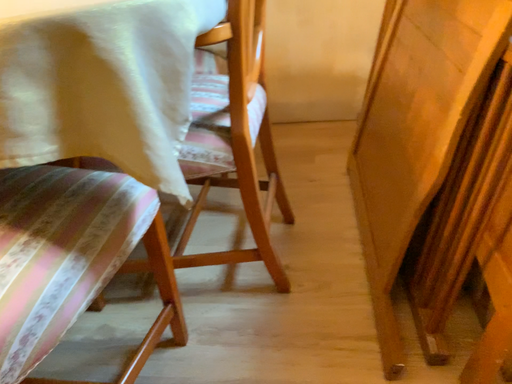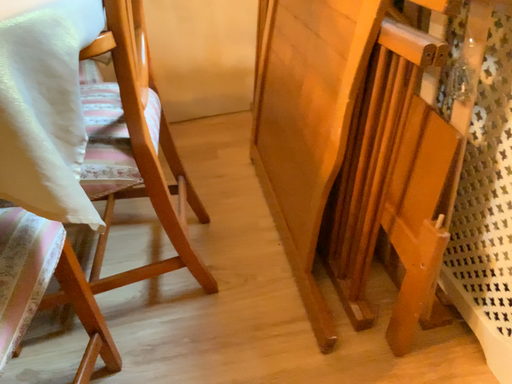
Question: How did the camera likely rotate when shooting the video?

Choices:
 (A) rotated right
 (B) rotated left

Answer: (A)